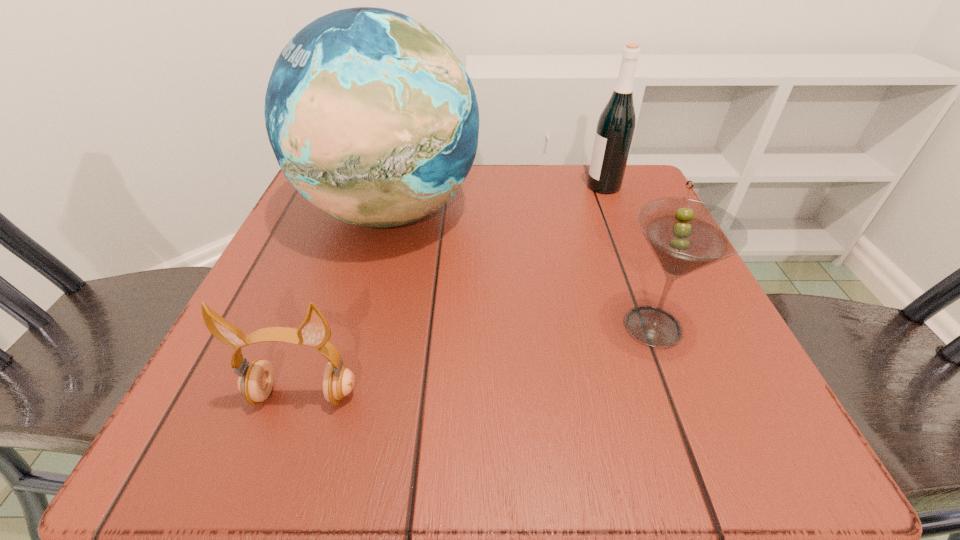
Identify the location of object at the near left corner. The height and width of the screenshot is (540, 960). (255, 382).

Locate an element on the screen. Image resolution: width=960 pixels, height=540 pixels. object at the far right corner is located at coordinates (616, 125).

What are the coordinates of `vacant space at the far edge of the desktop` in the screenshot? It's located at (506, 220).

Where is `free region at the near edge`? This screenshot has width=960, height=540. free region at the near edge is located at coordinates (506, 440).

Where is `free space at the left edge of the desktop`? The width and height of the screenshot is (960, 540). free space at the left edge of the desktop is located at coordinates (292, 240).

Locate an element on the screen. Image resolution: width=960 pixels, height=540 pixels. blank space at the right edge of the desktop is located at coordinates (618, 234).

In the image, there is a desktop. Where is `vacant space at the near left corner`? The image size is (960, 540). vacant space at the near left corner is located at coordinates (234, 417).

This screenshot has width=960, height=540. In the image, there is a desktop. In order to click on vacant space at the near right corner in this screenshot , I will do `click(756, 399)`.

Locate an element on the screen. This screenshot has height=540, width=960. unoccupied position between the tallest object and the second nearest object is located at coordinates (521, 268).

Locate an element on the screen. vacant area that lies between the shortest object and the wine bottle is located at coordinates click(x=453, y=291).